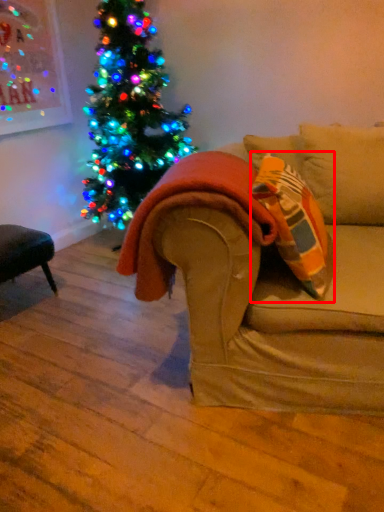
Question: From the image's perspective, what is the correct spatial positioning of throw pillow (annotated by the red box) in reference to blanket?

Choices:
 (A) above
 (B) below

Answer: (A)